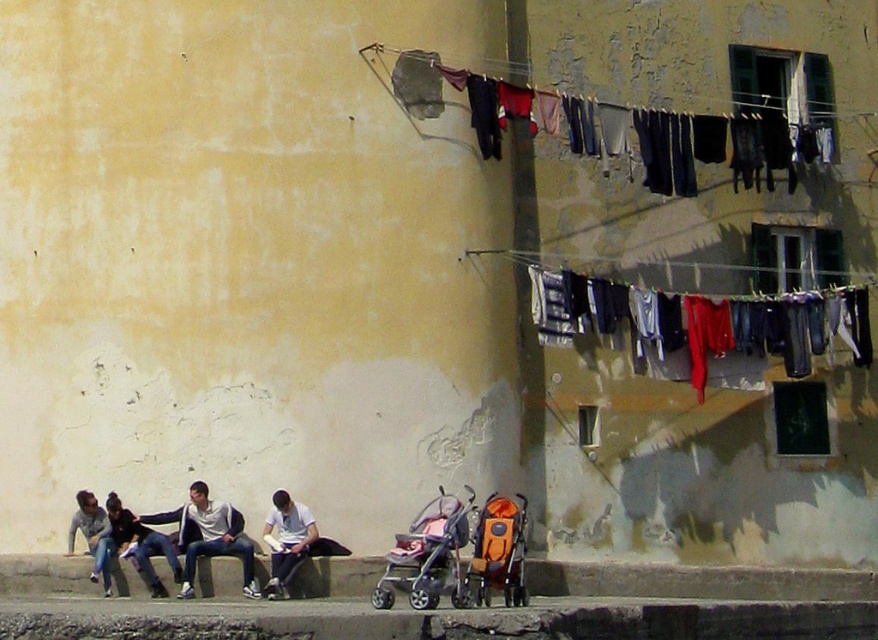
You are a laundry attendant who needs to fold the white matte shirt at lower center and the denim jeans at lower left. Which item requires a larger folding space?

The white matte shirt at lower center requires a larger folding space because it has a larger size compared to the denim jeans at lower left.

You are a delivery person trying to park your bike near the concrete curb at lower left. However, there are denim jeans at right hanging from the clothesline. Do you think the space between the clothesline and the wall is enough to park your bike without the jeans getting tangled?

The denim jeans at right has a smaller size compared to concrete curb at lower left, but the question about the space between the clothesline and the wall isn not addressed in the provided Objects Description. Therefore, I cannot determine if the space is sufficient for parking the bike without tangling the jeans.

You are standing in front of the wall and want to hang a new piece of clothing on the clothesline. There are two points on the clothesline marked as point 1 at (275, 548) and point 2 at (106, 579). Which point is closer to you?

Point 2 at (106, 579) is closer to you because it is in front of point 1 at (275, 548).